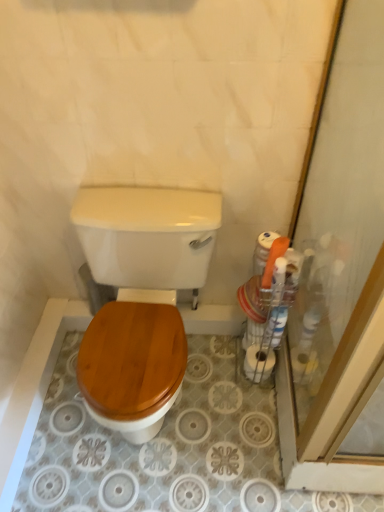
Question: Is transparent glass screen door at right to the right of white matte toilet paper at right from the viewer's perspective?

Choices:
 (A) no
 (B) yes

Answer: (B)

Question: Is transparent glass screen door at right thinner than white matte toilet paper at right?

Choices:
 (A) no
 (B) yes

Answer: (A)

Question: Can you confirm if transparent glass screen door at right is bigger than white matte toilet paper at right?

Choices:
 (A) no
 (B) yes

Answer: (B)

Question: From the image's perspective, is transparent glass screen door at right beneath white matte toilet paper at right?

Choices:
 (A) no
 (B) yes

Answer: (A)

Question: From a real-world perspective, is transparent glass screen door at right positioned under white matte toilet paper at right based on gravity?

Choices:
 (A) yes
 (B) no

Answer: (B)

Question: Is transparent glass screen door at right closer to camera compared to white matte toilet paper at right?

Choices:
 (A) no
 (B) yes

Answer: (B)

Question: Considering the relative sizes of white matte toilet paper at right and wooden toilet seat at center in the image provided, is white matte toilet paper at right wider than wooden toilet seat at center?

Choices:
 (A) no
 (B) yes

Answer: (A)

Question: From a real-world perspective, does white matte toilet paper at right stand above wooden toilet seat at center?

Choices:
 (A) no
 (B) yes

Answer: (A)

Question: Is white matte toilet paper at right smaller than wooden toilet seat at center?

Choices:
 (A) yes
 (B) no

Answer: (A)

Question: Is white matte toilet paper at right positioned in front of wooden toilet seat at center?

Choices:
 (A) yes
 (B) no

Answer: (B)

Question: Does white matte toilet paper at right contain wooden toilet seat at center?

Choices:
 (A) yes
 (B) no

Answer: (B)

Question: Is white matte toilet paper at right to the right of wooden toilet seat at center from the viewer's perspective?

Choices:
 (A) yes
 (B) no

Answer: (A)

Question: Is wooden toilet seat at center wider than white matte toilet paper at right?

Choices:
 (A) no
 (B) yes

Answer: (B)